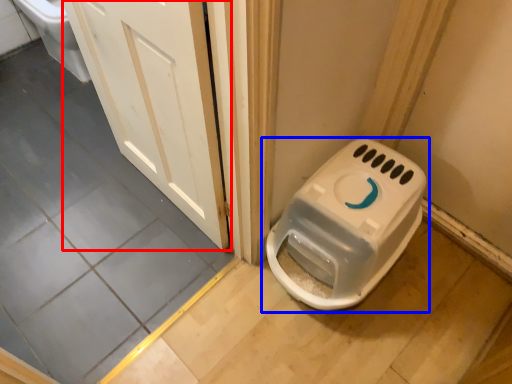
Question: Among these objects, which one is farthest to the camera, door (highlighted by a red box) or toilet (highlighted by a blue box)?

Choices:
 (A) door
 (B) toilet

Answer: (B)